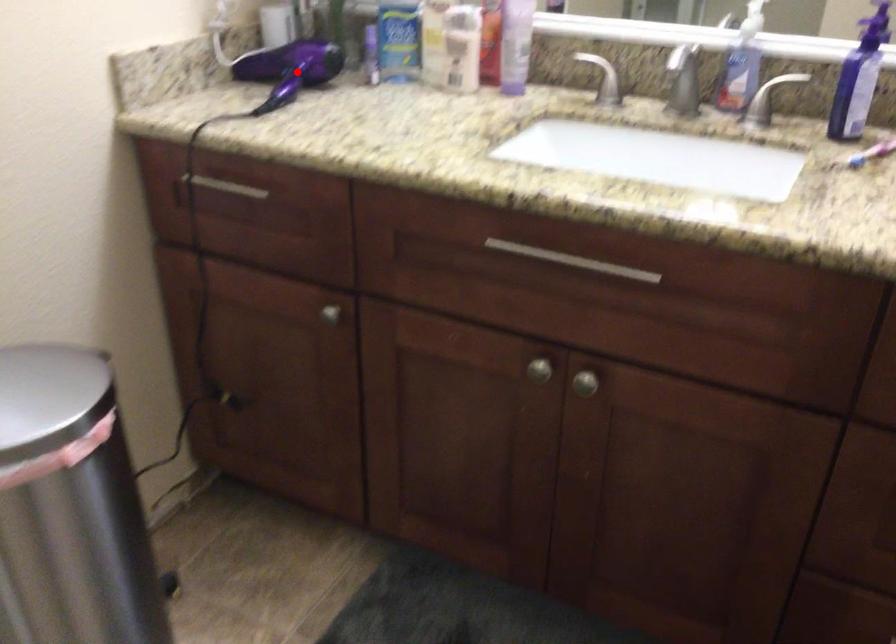
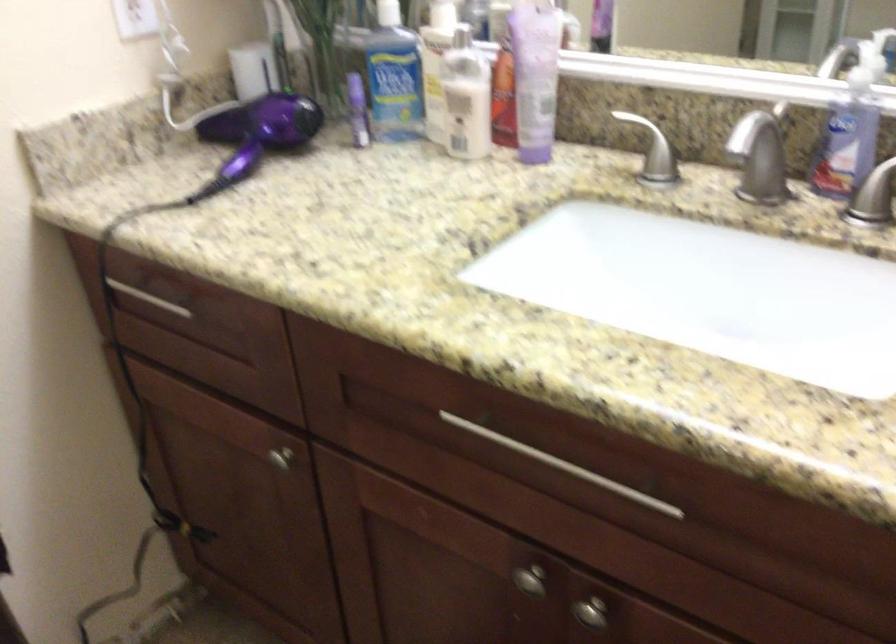
Question: I am providing you with two images of the same scene from different viewpoints. A red point is shown in image1. For the corresponding object point in image2, is it positioned nearer or farther from the camera?

Choices:
 (A) Nearer
 (B) Farther

Answer: (A)